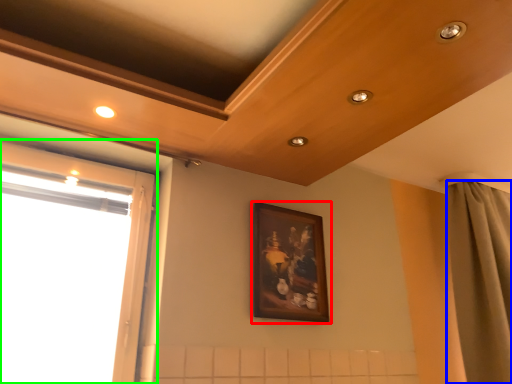
Question: Which object is positioned farthest from picture frame (highlighted by a red box)? Select from curtain (highlighted by a blue box) and window (highlighted by a green box).

Choices:
 (A) curtain
 (B) window

Answer: (A)